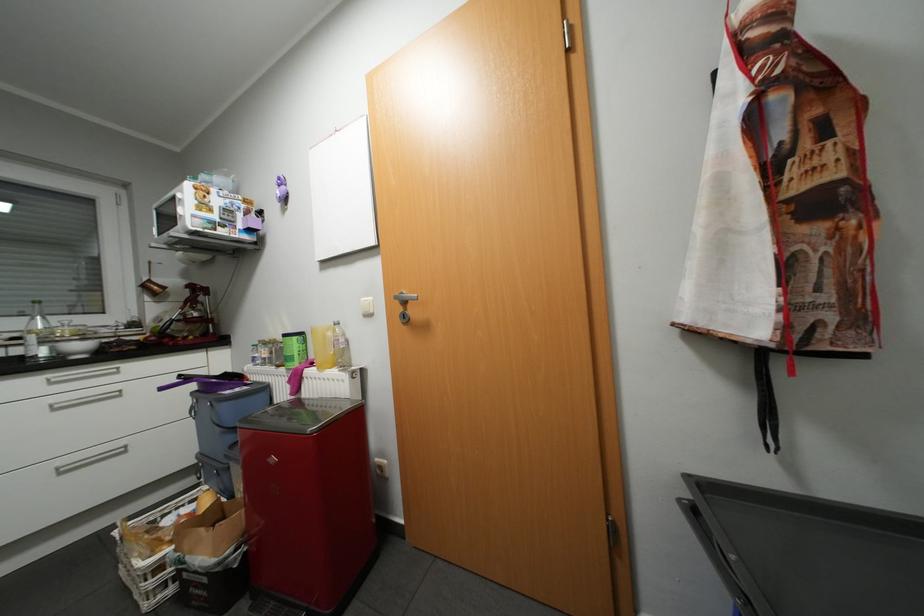
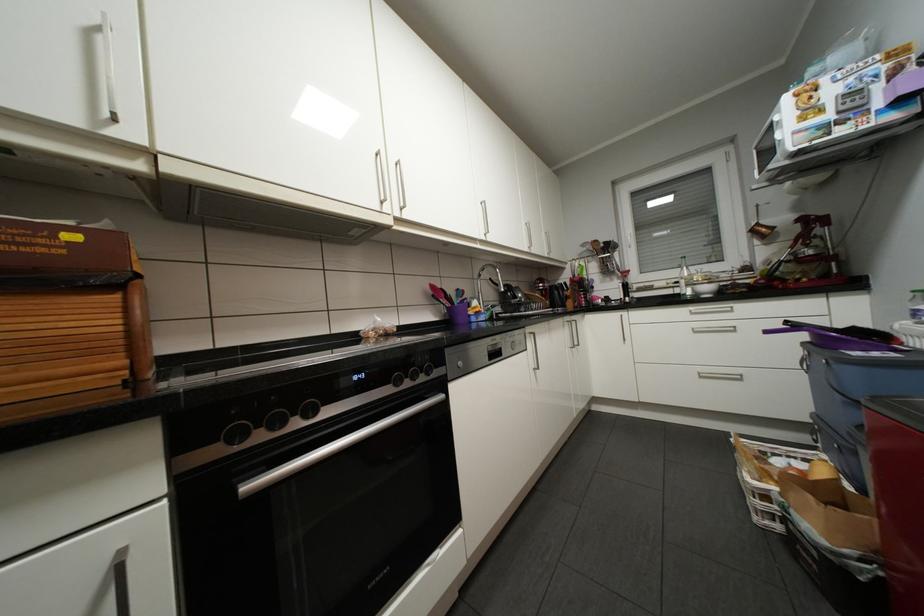
Locate, in the second image, the point that corresponds to (204,288) in the first image.

(819, 220)